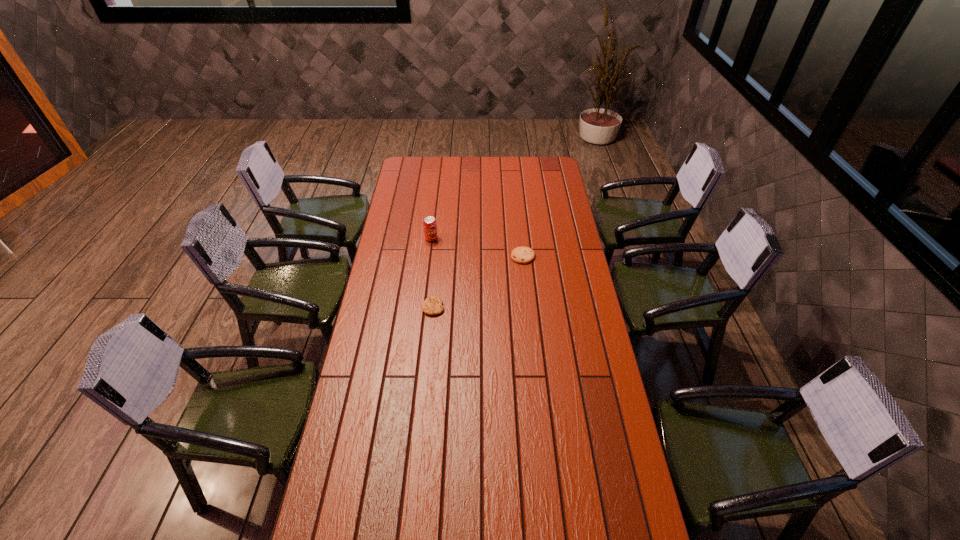
At what (x,y) coordinates should I click in order to perform the action: click on soda. Please return your answer as a coordinate pair (x, y). The height and width of the screenshot is (540, 960). Looking at the image, I should click on (430, 227).

Locate an element on the screen. The width and height of the screenshot is (960, 540). the farthest object is located at coordinates (430, 227).

At what (x,y) coordinates should I click in order to perform the action: click on the taller cookie. Please return your answer as a coordinate pair (x, y). Image resolution: width=960 pixels, height=540 pixels. Looking at the image, I should click on (522, 255).

Locate an element on the screen. the second tallest object is located at coordinates (522, 255).

You are a GUI agent. You are given a task and a screenshot of the screen. Output one action in this format:
    pyautogui.click(x=<x>, y=<y>)
    Task: Click on the nearer cookie
    
    Given the screenshot: What is the action you would take?
    pyautogui.click(x=433, y=305)

Locate an element on the screen. the left cookie is located at coordinates (433, 305).

You are a GUI agent. You are given a task and a screenshot of the screen. Output one action in this format:
    pyautogui.click(x=<x>, y=<y>)
    Task: Click on the vacant area situated on the right of the farthest object
    
    Given the screenshot: What is the action you would take?
    pyautogui.click(x=504, y=239)

Locate an element on the screen. The height and width of the screenshot is (540, 960). vacant space situated 0.190m on the right of the second farthest object is located at coordinates (576, 256).

Where is `vacant area situated 0.190m on the right of the nearest object`? Image resolution: width=960 pixels, height=540 pixels. vacant area situated 0.190m on the right of the nearest object is located at coordinates (491, 307).

I want to click on free space at the left edge, so click(394, 197).